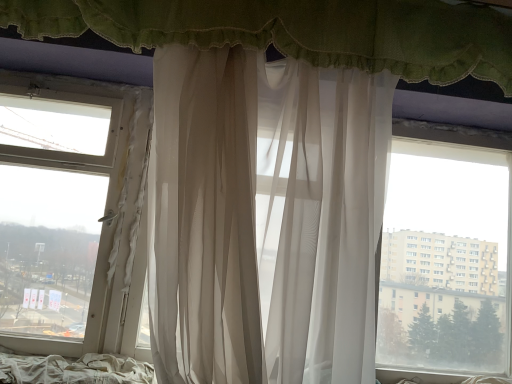
Question: In which direction should I rotate to look at sheer white curtain at center, the first curtain ordered from the bottom?

Choices:
 (A) right
 (B) left

Answer: (A)

Question: Considering the relative sizes of white fabric bed at lower left and sheer white curtain at center, marked as the 2th curtain in a top-to-bottom arrangement, in the image provided, is white fabric bed at lower left thinner than sheer white curtain at center, marked as the 2th curtain in a top-to-bottom arrangement,?

Choices:
 (A) no
 (B) yes

Answer: (B)

Question: Is white fabric bed at lower left smaller than sheer white curtain at center, the first curtain ordered from the bottom?

Choices:
 (A) yes
 (B) no

Answer: (A)

Question: Is white fabric bed at lower left aimed at sheer white curtain at center, the first curtain ordered from the bottom?

Choices:
 (A) yes
 (B) no

Answer: (B)

Question: Is white fabric bed at lower left beside sheer white curtain at center, the first curtain ordered from the bottom?

Choices:
 (A) no
 (B) yes

Answer: (A)

Question: Is white fabric bed at lower left positioned with its back to sheer white curtain at center, the first curtain ordered from the bottom?

Choices:
 (A) no
 (B) yes

Answer: (A)

Question: Does white fabric bed at lower left have a larger size compared to sheer white curtain at center, marked as the 2th curtain in a top-to-bottom arrangement?

Choices:
 (A) yes
 (B) no

Answer: (B)

Question: Is sheer white curtain at center, marked as the 2th curtain in a top-to-bottom arrangement, shorter than sheer white curtain at upper center, arranged as the 1th curtain when viewed from the top?

Choices:
 (A) yes
 (B) no

Answer: (B)

Question: From a real-world perspective, is sheer white curtain at center, the first curtain ordered from the bottom, physically above sheer white curtain at upper center, acting as the 2th curtain starting from the bottom?

Choices:
 (A) no
 (B) yes

Answer: (A)

Question: Is sheer white curtain at center, the first curtain ordered from the bottom, smaller than sheer white curtain at upper center, arranged as the 1th curtain when viewed from the top?

Choices:
 (A) yes
 (B) no

Answer: (B)

Question: Is sheer white curtain at center, marked as the 2th curtain in a top-to-bottom arrangement, far from sheer white curtain at upper center, acting as the 2th curtain starting from the bottom?

Choices:
 (A) yes
 (B) no

Answer: (B)

Question: Considering the relative positions of sheer white curtain at center, marked as the 2th curtain in a top-to-bottom arrangement, and sheer white curtain at upper center, arranged as the 1th curtain when viewed from the top, in the image provided, is sheer white curtain at center, marked as the 2th curtain in a top-to-bottom arrangement, in front of sheer white curtain at upper center, arranged as the 1th curtain when viewed from the top,?

Choices:
 (A) yes
 (B) no

Answer: (A)

Question: Could you tell me if sheer white curtain at center, marked as the 2th curtain in a top-to-bottom arrangement, is facing sheer white curtain at upper center, arranged as the 1th curtain when viewed from the top?

Choices:
 (A) no
 (B) yes

Answer: (A)

Question: Considering the relative positions of white fabric bed at lower left and sheer white curtain at upper center, acting as the 2th curtain starting from the bottom, in the image provided, is white fabric bed at lower left to the left of sheer white curtain at upper center, acting as the 2th curtain starting from the bottom, from the viewer's perspective?

Choices:
 (A) no
 (B) yes

Answer: (B)